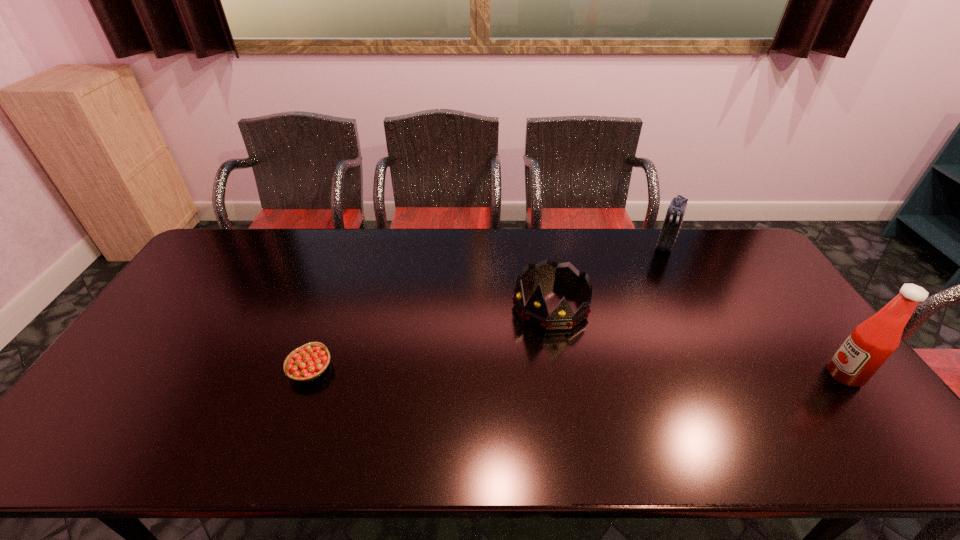
Locate an element on the screen. The height and width of the screenshot is (540, 960). vacant space located on the front-facing side of the condiment is located at coordinates tap(767, 375).

Locate an element on the screen. This screenshot has height=540, width=960. free location located 0.260m on the front-facing side of the condiment is located at coordinates (729, 375).

Locate an element on the screen. This screenshot has width=960, height=540. vacant space located with the zip open on the clutch bag is located at coordinates (647, 294).

You are a GUI agent. You are given a task and a screenshot of the screen. Output one action in this format:
    pyautogui.click(x=<x>, y=<y>)
    Task: Click on the vacant space located with the zip open on the clutch bag
    This screenshot has width=960, height=540.
    Given the screenshot: What is the action you would take?
    pyautogui.click(x=652, y=282)

At what (x,y) coordinates should I click in order to perform the action: click on free region located 0.390m with the zip open on the clutch bag. Please return your answer as a coordinate pair (x, y). The image size is (960, 540). Looking at the image, I should click on (634, 327).

You are a GUI agent. You are given a task and a screenshot of the screen. Output one action in this format:
    pyautogui.click(x=<x>, y=<y>)
    Task: Click on the vacant space located 0.070m at the front of the second object from left to right with jewels
    Image resolution: width=960 pixels, height=540 pixels.
    Given the screenshot: What is the action you would take?
    pyautogui.click(x=522, y=345)

Find the location of a particular element. vacant region located 0.090m at the front of the second object from left to right with jewels is located at coordinates (518, 349).

Where is `blank space located 0.300m at the front of the second object from left to right with jewels`? The width and height of the screenshot is (960, 540). blank space located 0.300m at the front of the second object from left to right with jewels is located at coordinates (478, 406).

This screenshot has width=960, height=540. What are the coordinates of `object that is at the far edge` in the screenshot? It's located at (675, 213).

You are a GUI agent. You are given a task and a screenshot of the screen. Output one action in this format:
    pyautogui.click(x=<x>, y=<y>)
    Task: Click on the object positioned at the right edge
    Image resolution: width=960 pixels, height=540 pixels.
    Given the screenshot: What is the action you would take?
    pyautogui.click(x=871, y=343)